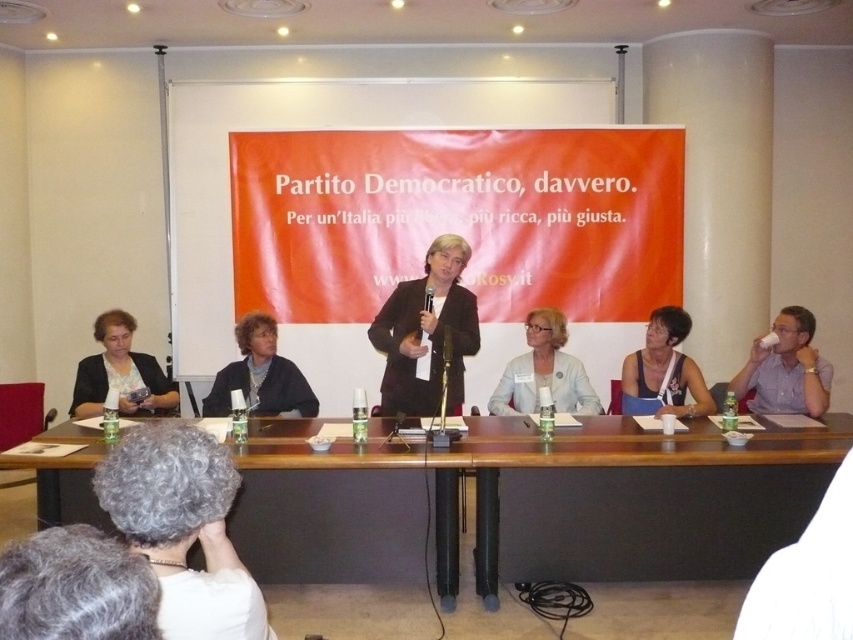
You are an event organizer who needs to place a large banner between the brown wooden table at center and the matte black tank top at center. Based on their positions, which object should the banner be placed to the right of?

The brown wooden table at center is positioned on the left side of matte black tank top at center, so the banner should be placed to the right of the matte black tank top at center.

You are a photographer positioned behind the brown wooden table at center, and you want to take a photo of the matte black tank top at center. Can you reach it with your hand without moving from your current position?

The brown wooden table at center is 28.29 inches away from matte black tank top at center. Since the distance is more than an average person can reach with their hand, you cannot reach the matte black tank top at center without moving.

You are organizing a photo shoot for a clothing brand and need to arrange two models wearing the light blue fabric jacket at center and the matte black tank top at center side by side. Based on the image, which clothing item requires more space horizontally for the model to pose comfortably?

The light blue fabric jacket at center requires more horizontal space because its width is larger than the matte black tank top at center.